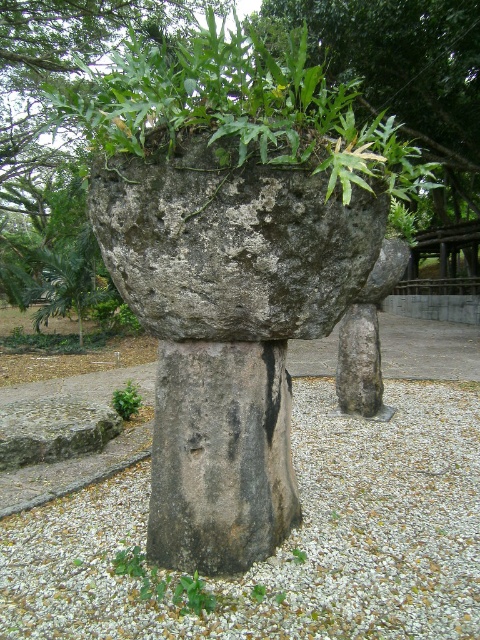
Question: Which object is the farthest from the green leafy plant at center?

Choices:
 (A) gray stone statue at center
 (B) green rough stone at upper center

Answer: (B)

Question: Does green rough stone at upper center have a smaller size compared to green leafy plant at center?

Choices:
 (A) yes
 (B) no

Answer: (B)

Question: Which point is farther from the camera taking this photo?

Choices:
 (A) (113, 268)
 (B) (346, 451)

Answer: (B)

Question: Does gray rough stone at center have a greater width compared to gray stone statue at center?

Choices:
 (A) yes
 (B) no

Answer: (A)

Question: Among these objects, which one is nearest to the camera?

Choices:
 (A) green rough stone at upper center
 (B) gray rough stone at center

Answer: (A)

Question: Considering the relative positions of gray rough stone at center and gray stone statue at center in the image provided, where is gray rough stone at center located with respect to gray stone statue at center?

Choices:
 (A) left
 (B) right

Answer: (A)